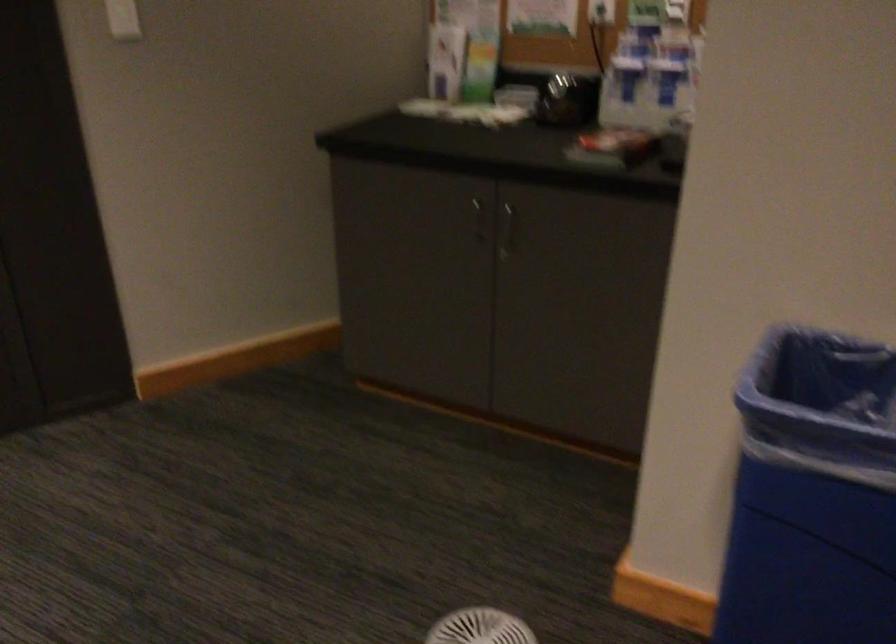
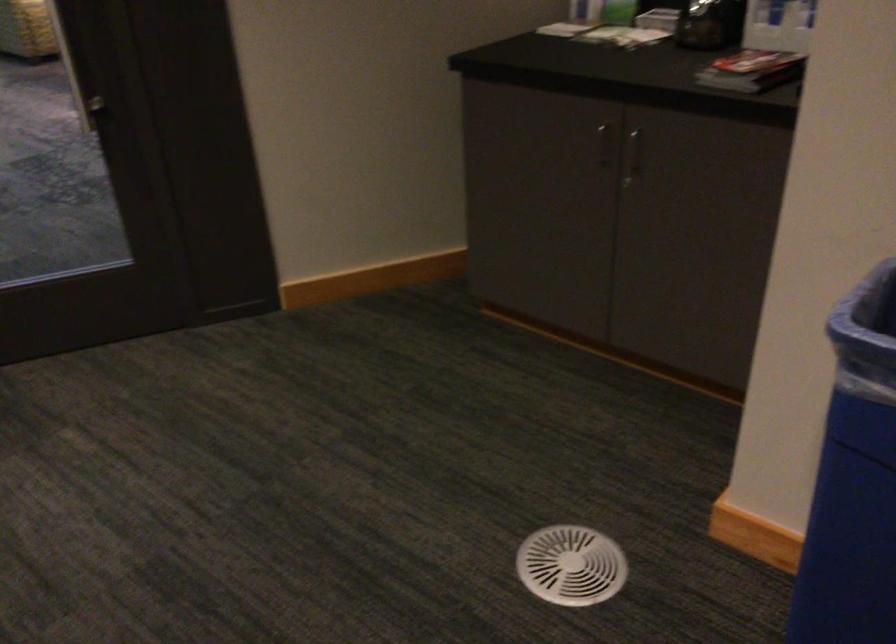
Where in the second image is the point corresponding to point 481,219 from the first image?

(604, 144)